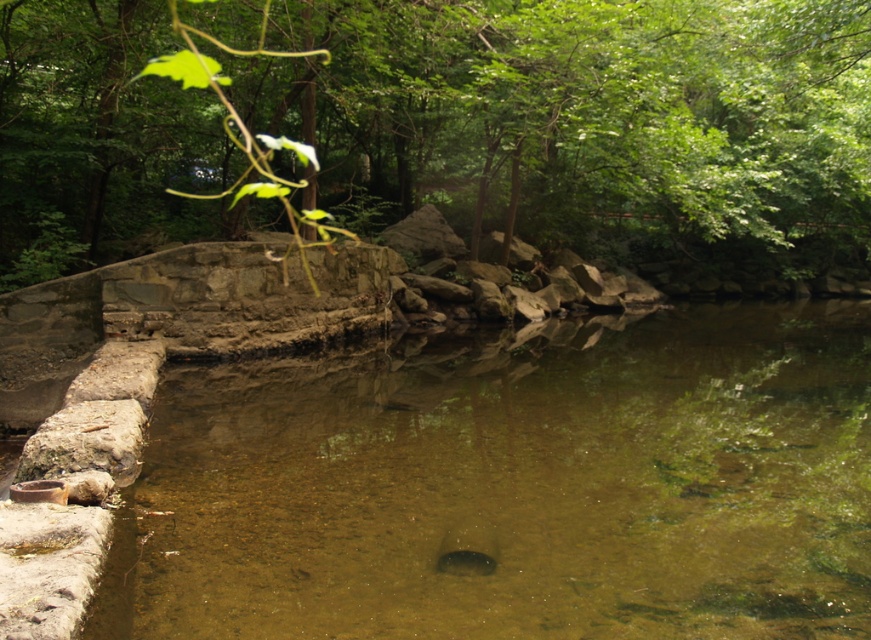
Question: Does clear water at center come in front of green leafy tree at upper center?

Choices:
 (A) yes
 (B) no

Answer: (A)

Question: Which point is farther to the camera?

Choices:
 (A) (765, 348)
 (B) (554, 19)

Answer: (A)

Question: Which object is closer to the camera taking this photo?

Choices:
 (A) clear water at center
 (B) green leafy tree at upper center

Answer: (A)

Question: Which point is farther from the camera taking this photo?

Choices:
 (A) (316, 586)
 (B) (66, 125)

Answer: (B)

Question: Can you confirm if clear water at center is positioned below green leafy tree at upper center?

Choices:
 (A) no
 (B) yes

Answer: (B)

Question: Is the position of clear water at center more distant than that of green leafy tree at upper center?

Choices:
 (A) yes
 (B) no

Answer: (B)